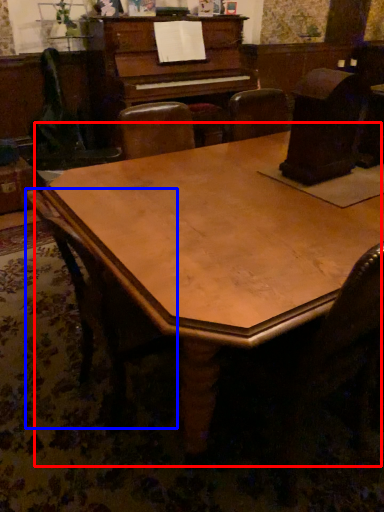
Question: Which object is further to the camera taking this photo, table (highlighted by a red box) or chair (highlighted by a blue box)?

Choices:
 (A) table
 (B) chair

Answer: (B)